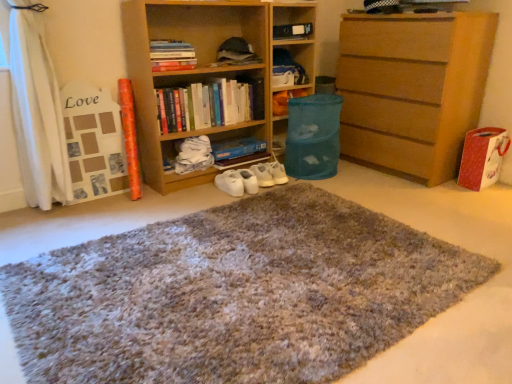
The width and height of the screenshot is (512, 384). Find the location of `unoccupied region to the right of white matte sneakers at center`. unoccupied region to the right of white matte sneakers at center is located at coordinates (276, 191).